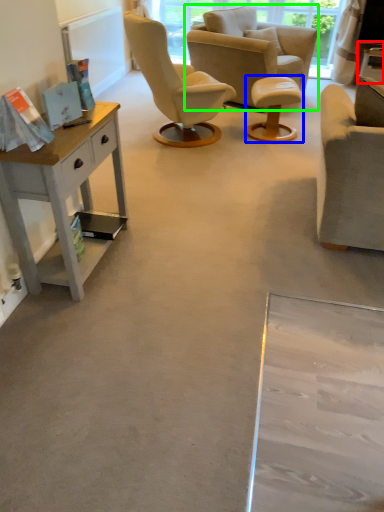
Question: Which object is positioned farthest from side table (highlighted by a red box)? Select from stool (highlighted by a blue box) and chair (highlighted by a green box).

Choices:
 (A) stool
 (B) chair

Answer: (B)